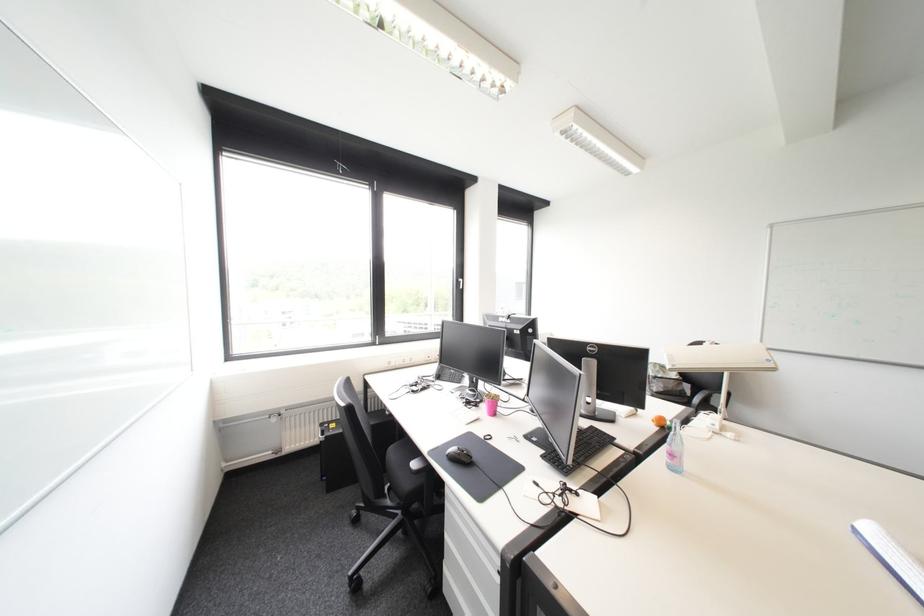
Where is `pink cup`? pink cup is located at coordinates (491, 403).